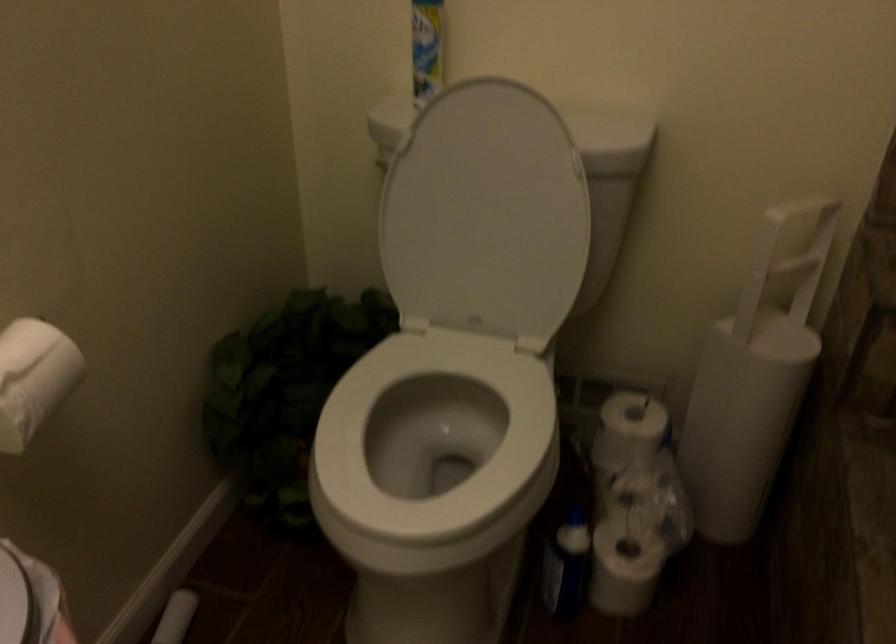
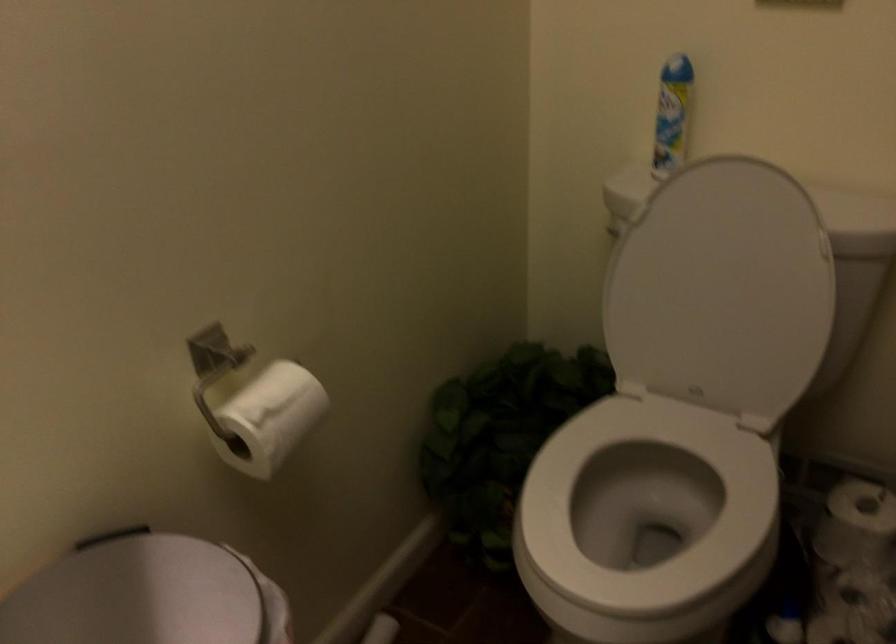
Question: The camera is either moving clockwise (left) or counter-clockwise (right) around the object. The first image is from the beginning of the video and the second image is from the end. Is the camera moving left or right when shooting the video?

Choices:
 (A) Left
 (B) Right

Answer: (B)